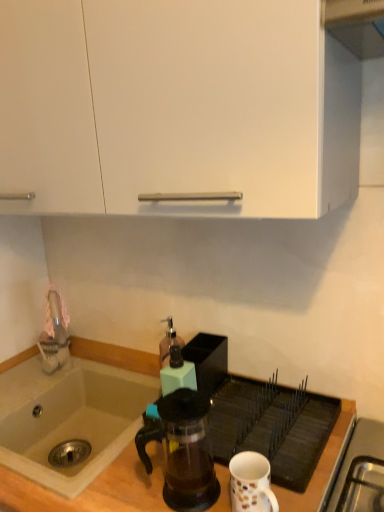
Question: From a real-world perspective, is matte plastic soap dispenser at center, the 2th kitchen appliance in the back-to-front sequence, positioned over wooden counter top at lower center based on gravity?

Choices:
 (A) no
 (B) yes

Answer: (B)

Question: From the image's perspective, is matte plastic soap dispenser at center, the 2th kitchen appliance in the back-to-front sequence, under wooden counter top at lower center?

Choices:
 (A) yes
 (B) no

Answer: (B)

Question: From a real-world perspective, is matte plastic soap dispenser at center, the 2th kitchen appliance in the back-to-front sequence, positioned under wooden counter top at lower center based on gravity?

Choices:
 (A) yes
 (B) no

Answer: (B)

Question: Does matte plastic soap dispenser at center, the 2th kitchen appliance in the back-to-front sequence, contain wooden counter top at lower center?

Choices:
 (A) yes
 (B) no

Answer: (B)

Question: Is matte plastic soap dispenser at center, which is counted as the 1th kitchen appliance, starting from the front, to the right of wooden counter top at lower center from the viewer's perspective?

Choices:
 (A) yes
 (B) no

Answer: (A)

Question: Is point (112, 474) closer or farther from the camera than point (104, 456)?

Choices:
 (A) closer
 (B) farther

Answer: (A)

Question: Looking at the image, does wooden counter top at lower center seem bigger or smaller compared to beige ceramic sink at lower left?

Choices:
 (A) big
 (B) small

Answer: (A)

Question: Visually, is wooden counter top at lower center positioned to the left or to the right of beige ceramic sink at lower left?

Choices:
 (A) left
 (B) right

Answer: (B)

Question: From the image's perspective, is wooden counter top at lower center located above or below beige ceramic sink at lower left?

Choices:
 (A) above
 (B) below

Answer: (B)

Question: Considering the positions of point (168, 324) and point (188, 381), is point (168, 324) closer or farther from the camera than point (188, 381)?

Choices:
 (A) closer
 (B) farther

Answer: (B)

Question: From a real-world perspective, is translucent glass soap dispenser at center, arranged as the 2th kitchen appliance when viewed from the front, physically located above or below matte plastic soap dispenser at center, which is counted as the 1th kitchen appliance, starting from the front?

Choices:
 (A) below
 (B) above

Answer: (A)

Question: In terms of height, does translucent glass soap dispenser at center, acting as the 1th kitchen appliance starting from the back, look taller or shorter compared to matte plastic soap dispenser at center, which is counted as the 1th kitchen appliance, starting from the front?

Choices:
 (A) short
 (B) tall

Answer: (B)

Question: Which is correct: translucent glass soap dispenser at center, acting as the 1th kitchen appliance starting from the back, is inside matte plastic soap dispenser at center, which is counted as the 1th kitchen appliance, starting from the front, or outside of it?

Choices:
 (A) outside
 (B) inside

Answer: (A)

Question: Looking at the image, does white ceramic mug at lower right seem bigger or smaller compared to matte plastic soap dispenser at center, the 2th kitchen appliance in the back-to-front sequence?

Choices:
 (A) big
 (B) small

Answer: (B)

Question: Looking at their shapes, would you say white ceramic mug at lower right is wider or thinner than matte plastic soap dispenser at center, which is counted as the 1th kitchen appliance, starting from the front?

Choices:
 (A) wide
 (B) thin

Answer: (A)